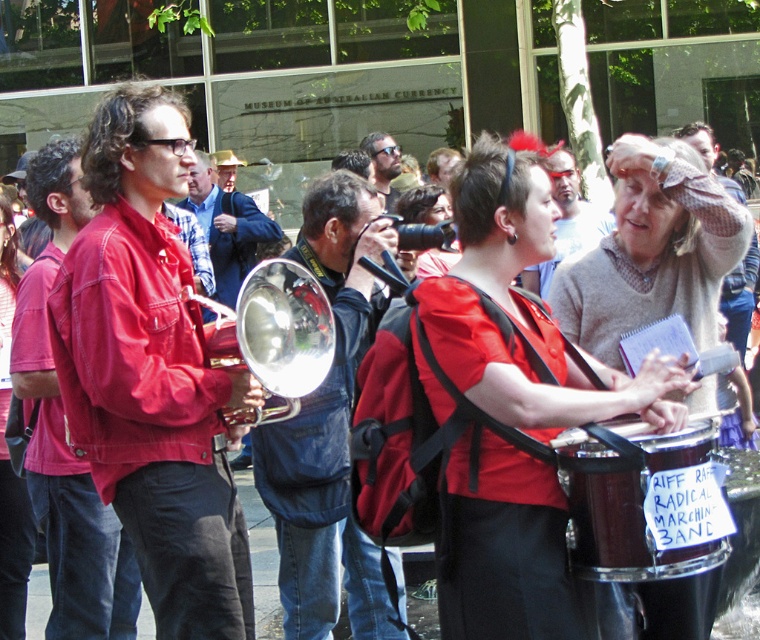
You are standing at the center of the scene. Which object is closer to the point marked at coordinates (152, 372)?

The matte red jacket at left is located at point (152, 372), so it is the closest object to that point.

Consider the image. You are standing in the outdoor event area and want to determine which of the two points, point [147,452] or point [391,140], is nearer to you. Based on the scene description, which point is closer?

Point [147,452] is closer to the viewer than point [391,140].

You are a photographer trying to capture a clear photo of the shiny dark brown drum at center and the matte black sunglasses at center. Since both are at the center, which object should you focus on to ensure the other is also in focus?

The shiny dark brown drum at center is in front of matte black sunglasses at center. So focus on the shiny dark brown drum at center to ensure both are in focus.